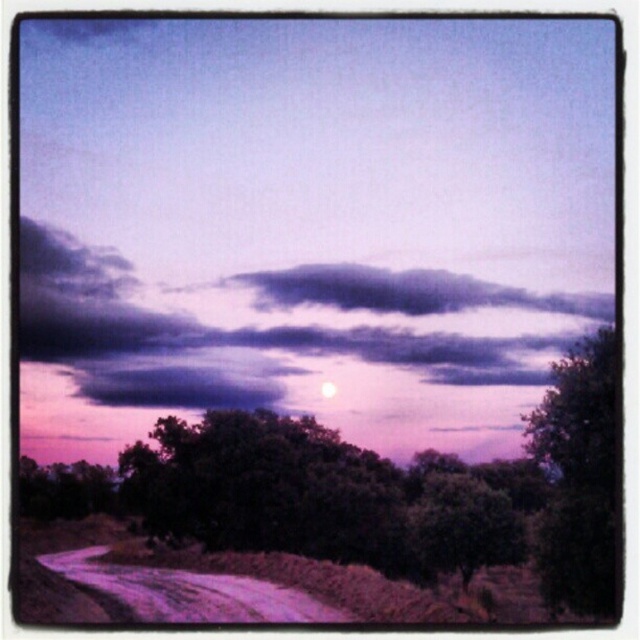
Image resolution: width=640 pixels, height=640 pixels. I want to click on purple dirt track at lower left, so click(188, 592).

Does purple dirt track at lower left appear under white glossy moon at center?

Correct, purple dirt track at lower left is located below white glossy moon at center.

Where is `purple dirt track at lower left`? The image size is (640, 640). purple dirt track at lower left is located at coordinates (188, 592).

Can you confirm if dark purple cloud at upper center is taller than dark green leafy tree at right?

Yes, dark purple cloud at upper center is taller than dark green leafy tree at right.

Between dark purple cloud at upper center and dark green leafy tree at right, which one is positioned higher?

dark purple cloud at upper center is above.

Does point (168, 376) come closer to viewer compared to point (554, 481)?

No, (168, 376) is further to viewer.

The width and height of the screenshot is (640, 640). I want to click on dark purple cloud at upper center, so click(x=276, y=324).

Is green leafy tree at center in front of white glossy moon at center?

That is True.

Which is in front, point (67, 520) or point (330, 387)?

Point (67, 520) is more forward.

The width and height of the screenshot is (640, 640). What do you see at coordinates (346, 515) in the screenshot?
I see `green leafy tree at center` at bounding box center [346, 515].

Identify the location of green leafy tree at center. (346, 515).